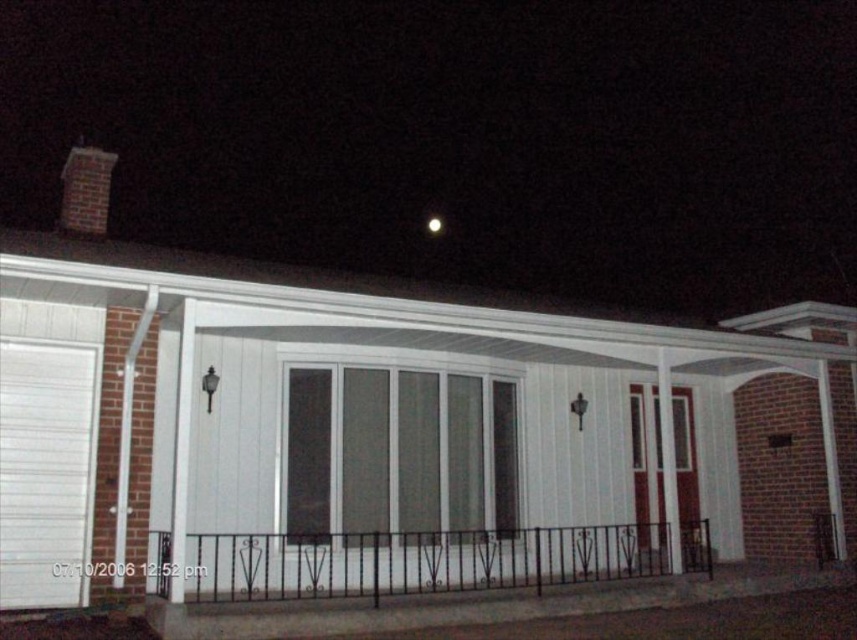
Is brick chimney at upper left wider than bright white sphere at upper center?

Correct, the width of brick chimney at upper left exceeds that of bright white sphere at upper center.

Can you confirm if brick chimney at upper left is shorter than bright white sphere at upper center?

In fact, brick chimney at upper left may be taller than bright white sphere at upper center.

This screenshot has height=640, width=857. In order to click on brick chimney at upper left in this screenshot , I will do `click(85, 189)`.

Image resolution: width=857 pixels, height=640 pixels. I want to click on brick chimney at upper left, so click(85, 189).

Can you confirm if black wrought iron railing at lower center is positioned to the left of brick chimney at upper left?

No, black wrought iron railing at lower center is not to the left of brick chimney at upper left.

At what (x,y) coordinates should I click in order to perform the action: click on black wrought iron railing at lower center. Please return your answer as a coordinate pair (x, y). Looking at the image, I should click on (405, 561).

Identify the location of black wrought iron railing at lower center. click(x=405, y=561).

Is point (582, 531) positioned after point (430, 221)?

No, it is not.

Identify the location of black wrought iron railing at lower center. This screenshot has height=640, width=857. (405, 561).

You are a GUI agent. You are given a task and a screenshot of the screen. Output one action in this format:
    pyautogui.click(x=<x>, y=<y>)
    Task: Click on the black wrought iron railing at lower center
    
    Given the screenshot: What is the action you would take?
    pyautogui.click(x=405, y=561)